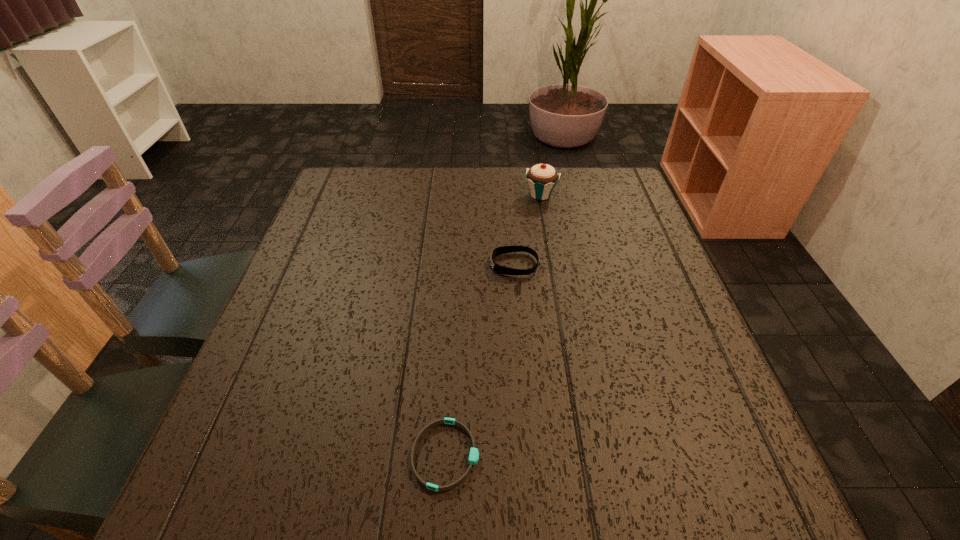
Choose which object is the second nearest neighbor to the shorter wristband. Please provide its 2D coordinates. Your answer should be formatted as a tuple, i.e. [(x, y)], where the tuple contains the x and y coordinates of a point satisfying the conditions above.

[(542, 178)]

In order to click on object that is the nearest to the second nearest object in this screenshot , I will do `click(542, 178)`.

Where is `free spot that satisfies the following two spatial constraints: 1. on the front side of the tallest object; 2. on the buckle of the leftmost object`? This screenshot has height=540, width=960. free spot that satisfies the following two spatial constraints: 1. on the front side of the tallest object; 2. on the buckle of the leftmost object is located at coordinates (587, 455).

I want to click on free point that satisfies the following two spatial constraints: 1. on the front side of the tallest object; 2. on the buckle of the nearer wristband, so click(587, 455).

Locate an element on the screen. The image size is (960, 540). vacant space that satisfies the following two spatial constraints: 1. on the front side of the cupcake; 2. on the buckle of the left wristband is located at coordinates (587, 455).